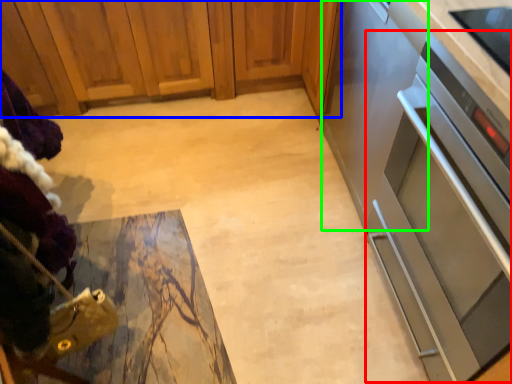
Question: Considering the real-world distances, which object is farthest from oven (highlighted by a red box)? cabinetry (highlighted by a blue box) or appliance (highlighted by a green box)?

Choices:
 (A) cabinetry
 (B) appliance

Answer: (A)